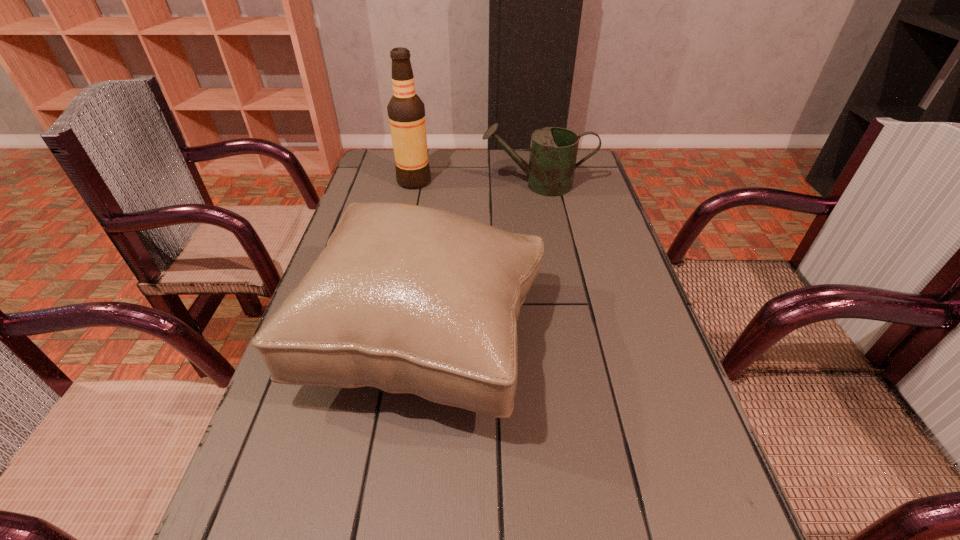
I want to click on the tallest object, so click(406, 112).

I want to click on the nearest object, so click(x=408, y=299).

Where is `cushion`? This screenshot has height=540, width=960. cushion is located at coordinates (408, 299).

At what (x,y) coordinates should I click in order to perform the action: click on the shortest object. Please return your answer as a coordinate pair (x, y). The image size is (960, 540). Looking at the image, I should click on (553, 152).

Where is `vacant space located 0.170m on the label of the tallest object`? vacant space located 0.170m on the label of the tallest object is located at coordinates (487, 181).

Identify the location of free space located on the back of the cushion. (440, 233).

Identify the location of free space located 0.210m with the spout on the shortest object. The width and height of the screenshot is (960, 540). (413, 185).

Identify the location of free space located 0.250m with the spout on the shortest object. The image size is (960, 540). (399, 185).

The image size is (960, 540). Find the location of `blank space located 0.210m with the spout on the shortest object`. blank space located 0.210m with the spout on the shortest object is located at coordinates (413, 185).

Where is `alcohol positioned at the far edge`? The width and height of the screenshot is (960, 540). alcohol positioned at the far edge is located at coordinates (406, 112).